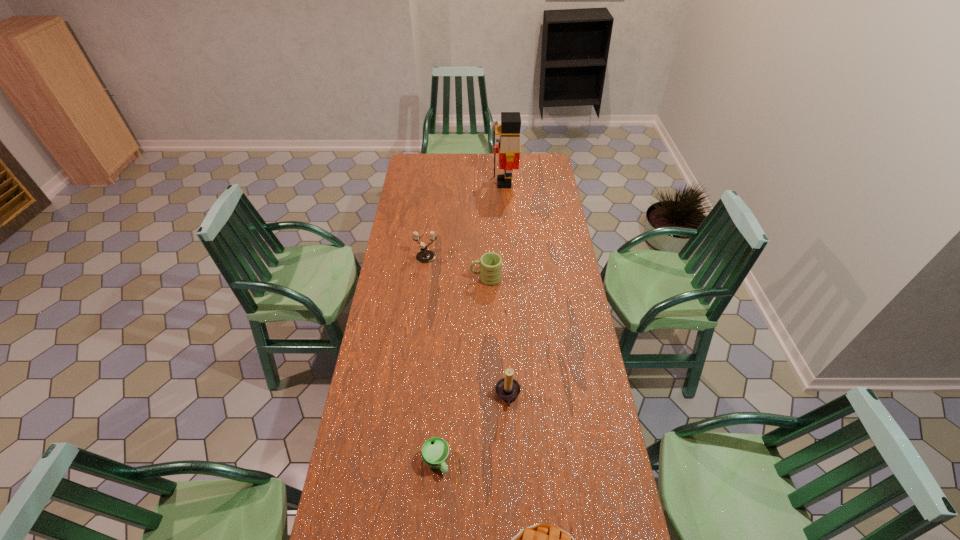
Identify the location of free spot located in front of the nutcracker holding the staff. (429, 183).

You are a GUI agent. You are given a task and a screenshot of the screen. Output one action in this format:
    pyautogui.click(x=<x>, y=<y>)
    Task: Click on the vacant space located in front of the nutcracker holding the staff
    The image size is (960, 540).
    Given the screenshot: What is the action you would take?
    pyautogui.click(x=465, y=183)

The width and height of the screenshot is (960, 540). I want to click on free region located in front of the nutcracker holding the staff, so click(438, 183).

Image resolution: width=960 pixels, height=540 pixels. Find the location of `free region located on the wick of the fourth farthest object`. free region located on the wick of the fourth farthest object is located at coordinates (444, 396).

This screenshot has height=540, width=960. Identify the location of free space located 0.070m on the wick of the fourth farthest object. (477, 396).

The image size is (960, 540). What are the coordinates of `vacant area situated 0.060m on the wick of the fourth farthest object` in the screenshot? It's located at coord(479,396).

Locate an element on the screen. Image resolution: width=960 pixels, height=540 pixels. vacant position located on the back of the farther candle holder is located at coordinates (431, 214).

Locate an element on the screen. The height and width of the screenshot is (540, 960). vacant space situated 0.050m on the side of the fourth tallest object with the handle is located at coordinates (460, 279).

Identify the location of vacant region located on the side of the fourth tallest object with the handle. (423, 279).

Identify the location of vacant space situated 0.160m on the side of the fourth tallest object with the handle. (436, 279).